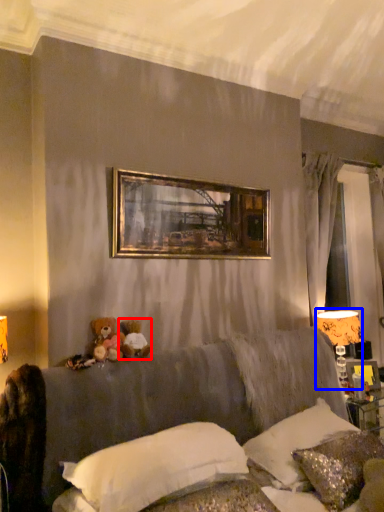
Question: Which object is further to the camera taking this photo, toy (highlighted by a red box) or table lamp (highlighted by a blue box)?

Choices:
 (A) toy
 (B) table lamp

Answer: (B)